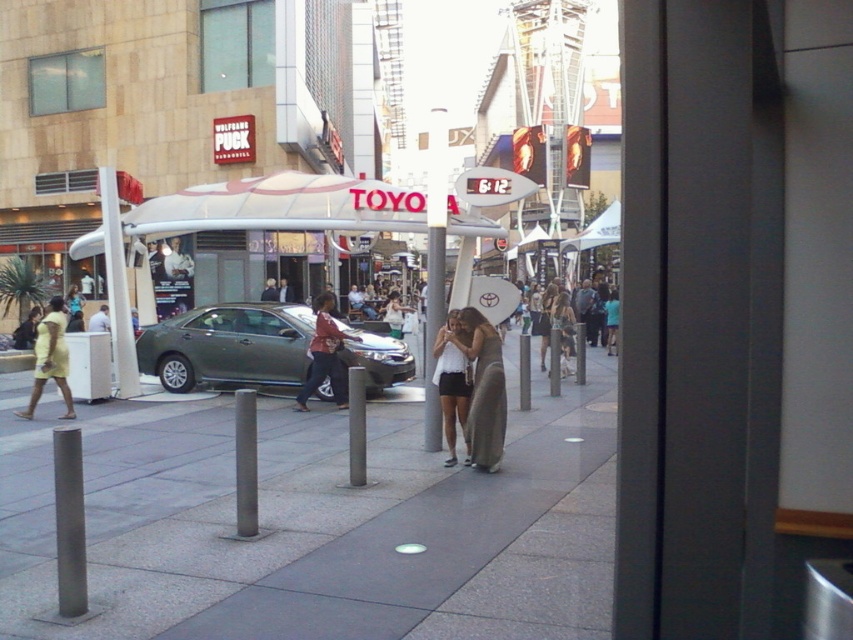
You are a photographer standing at the center of the street. You want to take a photo of the yellow matte dress at left. Where should you aim your camera to capture it in the frame?

You should aim your camera at point [50,358] to capture the yellow matte dress at left in the frame.